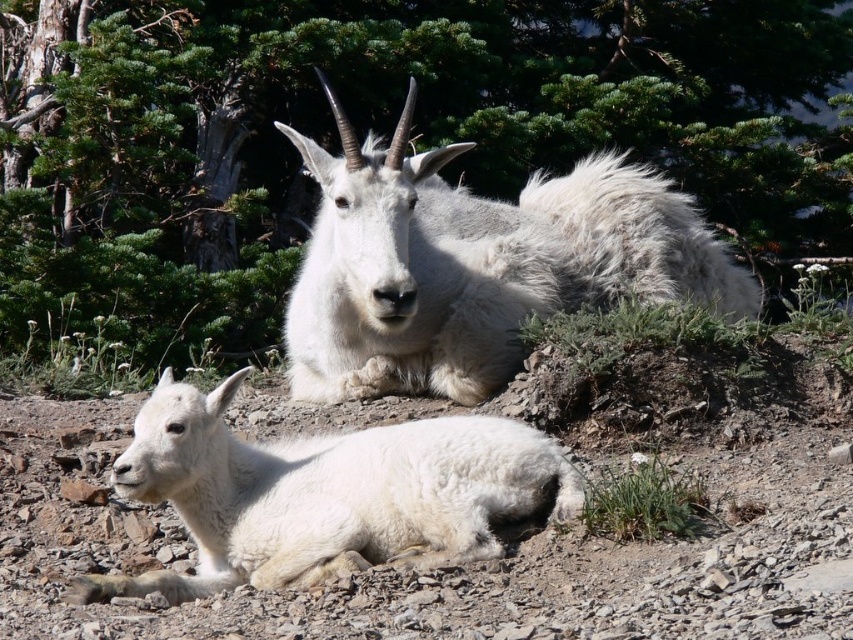
Question: Considering the real-world distances, which object is farthest from the white woolen goat at lower left?

Choices:
 (A) green leafy tree at upper center
 (B) white fluffy goat at center

Answer: (A)

Question: Which object is farther from the camera taking this photo?

Choices:
 (A) green leafy tree at upper center
 (B) white woolen goat at lower left

Answer: (A)

Question: Where is green leafy tree at upper center located in relation to white fluffy goat at center in the image?

Choices:
 (A) below
 (B) above

Answer: (B)

Question: Can you confirm if green leafy tree at upper center is positioned to the right of white woolen goat at lower left?

Choices:
 (A) no
 (B) yes

Answer: (B)

Question: Which point is closer to the camera taking this photo?

Choices:
 (A) (90, 582)
 (B) (502, 262)
 (C) (701, 120)

Answer: (A)

Question: Can you confirm if green leafy tree at upper center is positioned to the left of white fluffy goat at center?

Choices:
 (A) no
 (B) yes

Answer: (B)